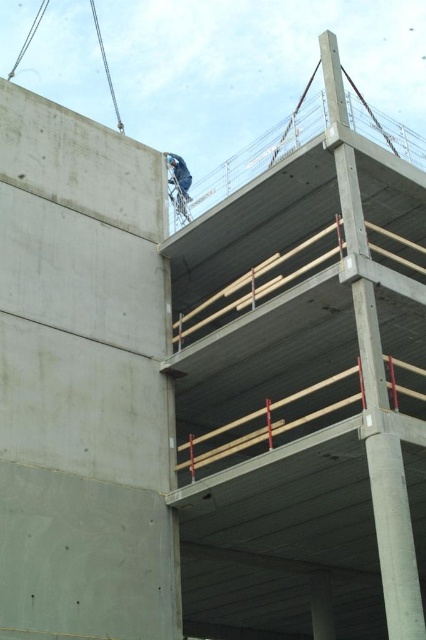
Question: Is smooth concrete at upper left thinner than blue fabric construction worker at upper center?

Choices:
 (A) yes
 (B) no

Answer: (B)

Question: Which point appears farthest from the camera in this image?

Choices:
 (A) (89, 234)
 (B) (172, 152)

Answer: (B)

Question: Does smooth concrete at upper left appear on the right side of blue fabric construction worker at upper center?

Choices:
 (A) yes
 (B) no

Answer: (B)

Question: Which point appears farthest from the camera in this image?

Choices:
 (A) (187, 182)
 (B) (37, 288)

Answer: (A)

Question: Can you confirm if smooth concrete at upper left is thinner than blue fabric construction worker at upper center?

Choices:
 (A) no
 (B) yes

Answer: (A)